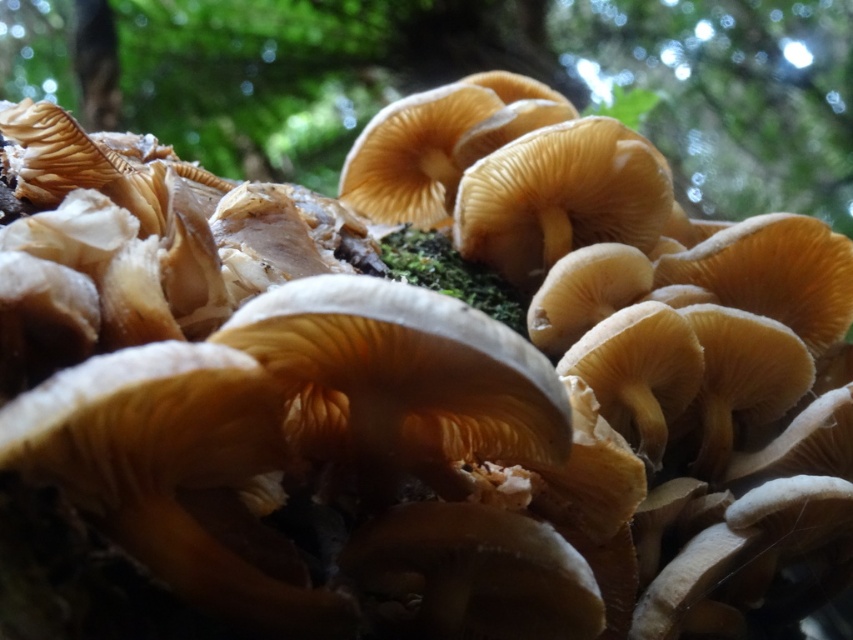
You are a mycologist studying the spatial arrangement of fungi in a forest. You observe the matte brown mushrooms at center and the brown rough tree trunk at upper left in the scene. Which object occupies more horizontal space in the image?

The matte brown mushrooms at center occupy more horizontal space because their width is larger than that of the brown rough tree trunk at upper left.